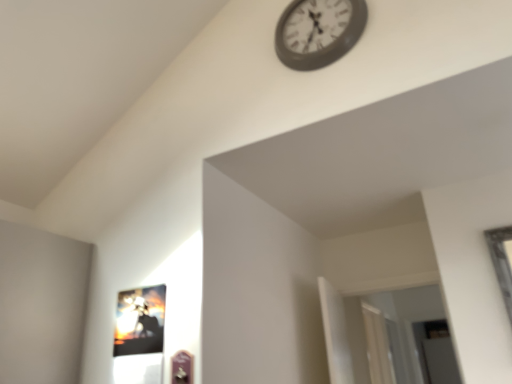
Question: Is metallic gray clock at upper center in front of or behind metallic glossy picture frame at lower left in the image?

Choices:
 (A) behind
 (B) front

Answer: (A)

Question: Considering the positions of metallic gray clock at upper center and metallic glossy picture frame at lower left in the image, is metallic gray clock at upper center bigger or smaller than metallic glossy picture frame at lower left?

Choices:
 (A) big
 (B) small

Answer: (A)

Question: Considering the positions of metallic gray clock at upper center and metallic glossy picture frame at lower left in the image, is metallic gray clock at upper center wider or thinner than metallic glossy picture frame at lower left?

Choices:
 (A) thin
 (B) wide

Answer: (B)

Question: Is metallic glossy picture frame at lower left inside or outside of metallic gray clock at upper center?

Choices:
 (A) outside
 (B) inside

Answer: (A)

Question: In terms of height, does metallic glossy picture frame at lower left look taller or shorter compared to metallic gray clock at upper center?

Choices:
 (A) tall
 (B) short

Answer: (B)

Question: Is metallic glossy picture frame at lower left in front of or behind metallic gray clock at upper center in the image?

Choices:
 (A) front
 (B) behind

Answer: (A)

Question: In the image, is metallic glossy picture frame at lower left on the left side or the right side of metallic gray clock at upper center?

Choices:
 (A) left
 (B) right

Answer: (A)